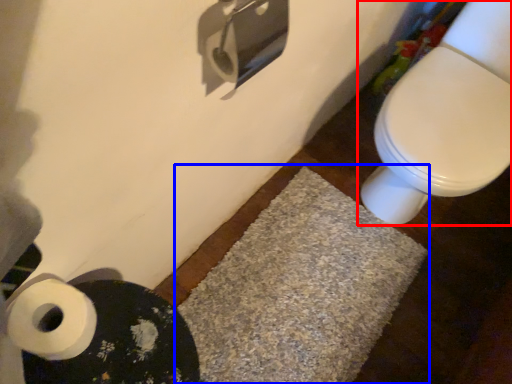
Question: Which of the following is the closest to the observer, toilet (highlighted by a red box) or bath mat (highlighted by a blue box)?

Choices:
 (A) toilet
 (B) bath mat

Answer: (A)